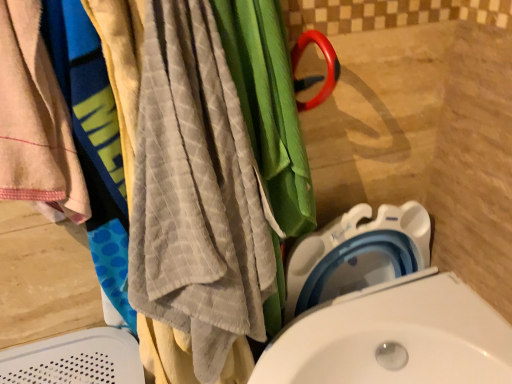
Question: Considering the relative sizes of beige cotton towel at left and white plastic toilet at lower right in the image provided, is beige cotton towel at left shorter than white plastic toilet at lower right?

Choices:
 (A) yes
 (B) no

Answer: (A)

Question: Is beige cotton towel at left far from white plastic toilet at lower right?

Choices:
 (A) no
 (B) yes

Answer: (A)

Question: Is beige cotton towel at left looking in the opposite direction of white plastic toilet at lower right?

Choices:
 (A) no
 (B) yes

Answer: (A)

Question: Can you confirm if beige cotton towel at left is wider than white plastic toilet at lower right?

Choices:
 (A) yes
 (B) no

Answer: (A)

Question: Could you tell me if beige cotton towel at left is turned towards white plastic toilet at lower right?

Choices:
 (A) yes
 (B) no

Answer: (B)

Question: Based on their positions, is gray textured towel at left located to the left or right of white plastic toilet at lower right?

Choices:
 (A) right
 (B) left

Answer: (B)

Question: In terms of height, does gray textured towel at left look taller or shorter compared to white plastic toilet at lower right?

Choices:
 (A) short
 (B) tall

Answer: (B)

Question: From the image's perspective, relative to white plastic toilet at lower right, is gray textured towel at left above or below?

Choices:
 (A) above
 (B) below

Answer: (A)

Question: Considering the positions of gray textured towel at left and white plastic toilet at lower right in the image, is gray textured towel at left bigger or smaller than white plastic toilet at lower right?

Choices:
 (A) big
 (B) small

Answer: (A)

Question: Is beige cotton towel at left spatially inside gray textured towel at left, or outside of it?

Choices:
 (A) inside
 (B) outside

Answer: (B)

Question: In terms of width, does beige cotton towel at left look wider or thinner when compared to gray textured towel at left?

Choices:
 (A) thin
 (B) wide

Answer: (A)

Question: Considering the relative positions of beige cotton towel at left and gray textured towel at left in the image provided, is beige cotton towel at left to the left or to the right of gray textured towel at left?

Choices:
 (A) left
 (B) right

Answer: (A)

Question: From a real-world perspective, is beige cotton towel at left physically located above or below gray textured towel at left?

Choices:
 (A) above
 (B) below

Answer: (A)

Question: In the image, is gray textured towel at left positioned in front of or behind beige cotton towel at left?

Choices:
 (A) behind
 (B) front

Answer: (B)

Question: Visually, is gray textured towel at left positioned to the left or to the right of beige cotton towel at left?

Choices:
 (A) left
 (B) right

Answer: (B)